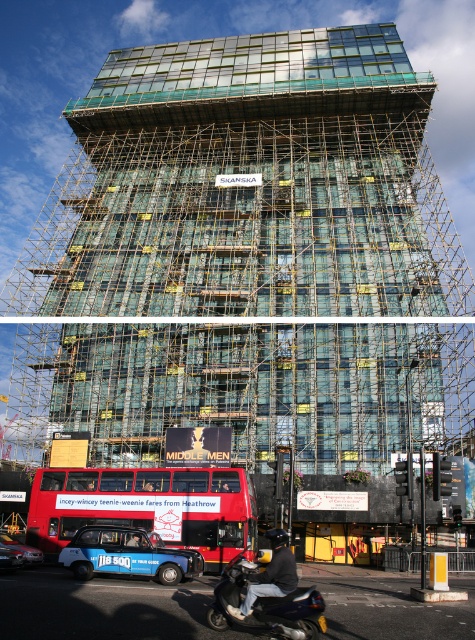
Between red matte double-decker bus at lower left and dark gray leather jacket at lower center, which one appears on the right side from the viewer's perspective?

dark gray leather jacket at lower center

Does red matte double-decker bus at lower left have a lesser height compared to dark gray leather jacket at lower center?

No.

Does point (246, 518) lie in front of point (282, 556)?

No, it is behind (282, 556).

Where is `red matte double-decker bus at lower left`? This screenshot has width=475, height=640. red matte double-decker bus at lower left is located at coordinates (148, 506).

Does shiny black scooter at lower center have a smaller size compared to dark gray leather jacket at lower center?

Incorrect, shiny black scooter at lower center is not smaller in size than dark gray leather jacket at lower center.

Which is more to the left, shiny black scooter at lower center or dark gray leather jacket at lower center?

shiny black scooter at lower center is more to the left.

Find the location of a particular element. shiny black scooter at lower center is located at coordinates (290, 614).

Can you confirm if red matte double-decker bus at lower left is shorter than shiny black scooter at lower center?

In fact, red matte double-decker bus at lower left may be taller than shiny black scooter at lower center.

Is point (212, 554) farther from viewer compared to point (230, 593)?

Yes.

Where is `red matte double-decker bus at lower left`? This screenshot has width=475, height=640. red matte double-decker bus at lower left is located at coordinates (148, 506).